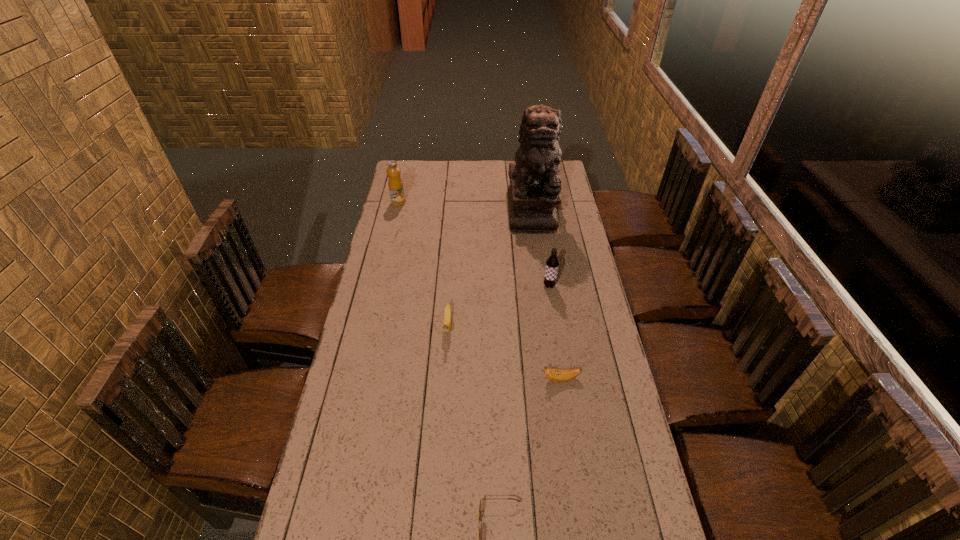
Image resolution: width=960 pixels, height=540 pixels. Find the location of `free space located 0.290m on the back of the third tallest object`. free space located 0.290m on the back of the third tallest object is located at coordinates (541, 236).

This screenshot has width=960, height=540. Find the location of `vacant space located 0.330m at the stem of the second object from left to right`. vacant space located 0.330m at the stem of the second object from left to right is located at coordinates (440, 433).

You are a GUI agent. You are given a task and a screenshot of the screen. Output one action in this format:
    pyautogui.click(x=<x>, y=<y>)
    Task: Click on the free space located on the back of the nearer banana
    
    Given the screenshot: What is the action you would take?
    pyautogui.click(x=547, y=292)

I want to click on object at the left edge, so click(395, 184).

At what (x,y) coordinates should I click in order to perform the action: click on sculpture present at the right edge. Please return your answer as a coordinate pair (x, y). Looking at the image, I should click on (533, 194).

Find the location of a particular element. The image size is (960, 540). root beer at the right edge is located at coordinates (552, 263).

Identify the location of banana located at the right edge. Image resolution: width=960 pixels, height=540 pixels. (558, 375).

In the image, there is a desktop. Find the location of `free space at the far edge`. free space at the far edge is located at coordinates (493, 163).

Image resolution: width=960 pixels, height=540 pixels. In the image, there is a desktop. What are the coordinates of `vacant space at the left edge` in the screenshot? It's located at (363, 439).

Find the location of a particular element. The width and height of the screenshot is (960, 540). vacant space at the far left corner of the desktop is located at coordinates (402, 166).